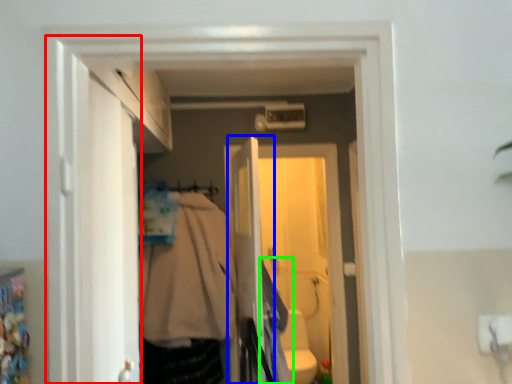
Question: Which is nearer to the door (highlighted by a red box)? screen door (highlighted by a blue box) or clothing (highlighted by a green box).

Choices:
 (A) screen door
 (B) clothing

Answer: (A)